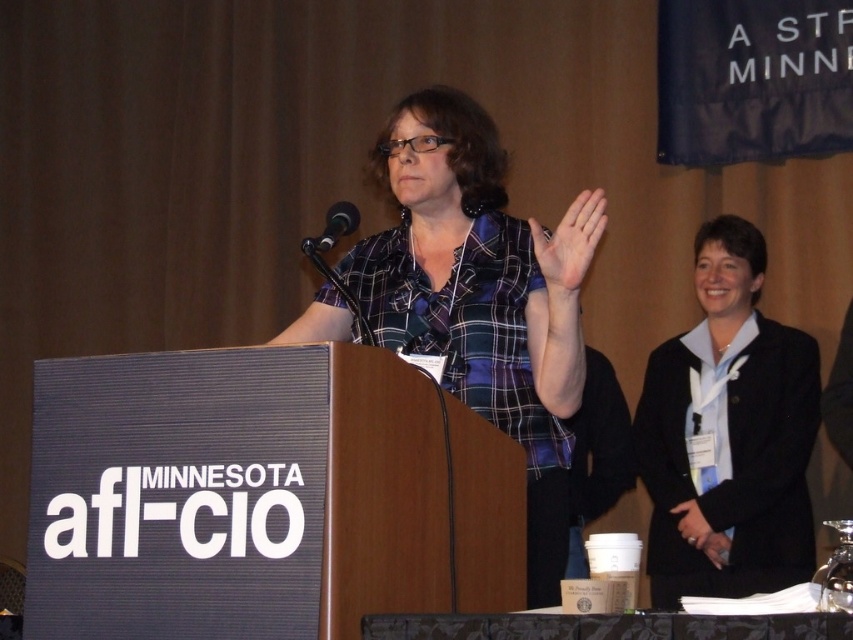
Question: Which point is closer to the camera?

Choices:
 (A) black plastic microphone at upper center
 (B) plaid fabric shirt at center

Answer: (B)

Question: Observing the image, what is the correct spatial positioning of plaid fabric shirt at center in reference to black matte blazer at right?

Choices:
 (A) below
 (B) above

Answer: (B)

Question: Which point is closer to the camera?

Choices:
 (A) pyautogui.click(x=332, y=237)
 (B) pyautogui.click(x=454, y=321)
 (C) pyautogui.click(x=454, y=628)
 (D) pyautogui.click(x=714, y=342)

Answer: (C)

Question: Which object is the farthest from the plaid fabric shirt at center?

Choices:
 (A) black fabric table at lower center
 (B) black matte blazer at right
 (C) black plastic microphone at upper center

Answer: (B)

Question: Is plaid fabric shirt at center below black matte blazer at right?

Choices:
 (A) no
 (B) yes

Answer: (A)

Question: Does black matte blazer at right have a greater width compared to black fabric table at lower center?

Choices:
 (A) yes
 (B) no

Answer: (B)